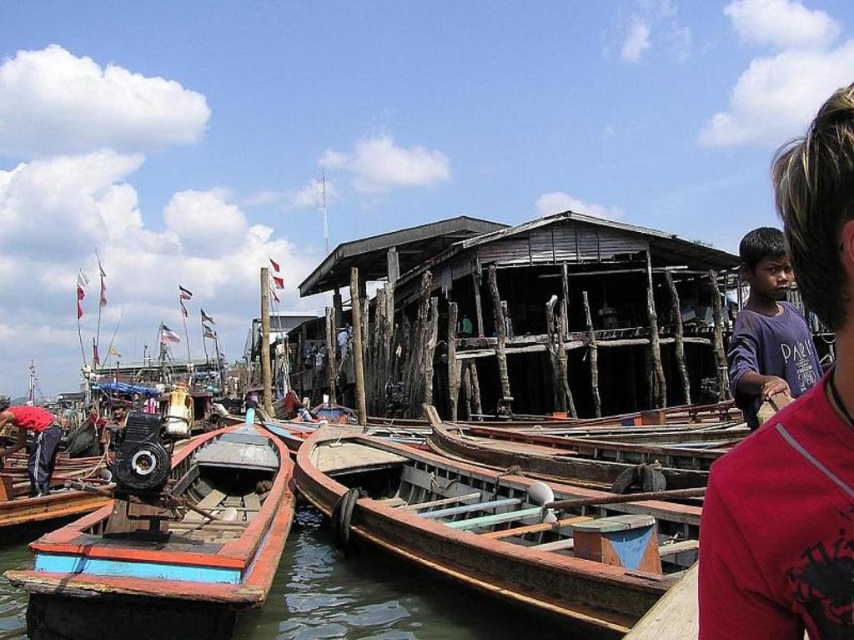
Can you confirm if dark blue t-shirt at center is positioned to the left of wooden boat at center?

Incorrect, dark blue t-shirt at center is not on the left side of wooden boat at center.

Does point (814, 120) lie in front of point (113, 618)?

No, (814, 120) is behind (113, 618).

Locate an element on the screen. dark blue t-shirt at center is located at coordinates (794, 432).

Is wooden canoe at center in front of purple cotton shirt at upper right?

Yes.

Which is below, wooden canoe at center or purple cotton shirt at upper right?

wooden canoe at center is below.

Identify the location of wooden canoe at center. point(496,528).

Can you confirm if dark blue t-shirt at center is wider than purple cotton shirt at upper right?

Correct, the width of dark blue t-shirt at center exceeds that of purple cotton shirt at upper right.

Which is above, dark blue t-shirt at center or purple cotton shirt at upper right?

purple cotton shirt at upper right is higher up.

Identify the location of dark blue t-shirt at center. The image size is (854, 640). (794, 432).